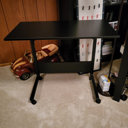
Where is `wood wall panneling`? The width and height of the screenshot is (128, 128). wood wall panneling is located at coordinates (35, 14).